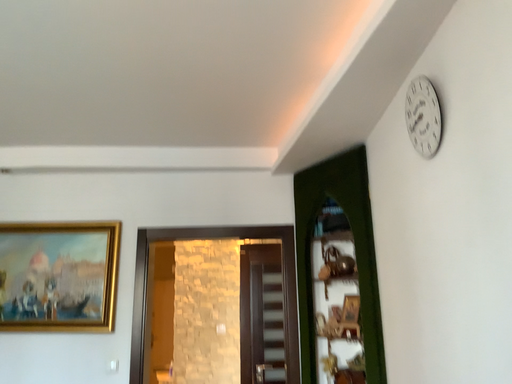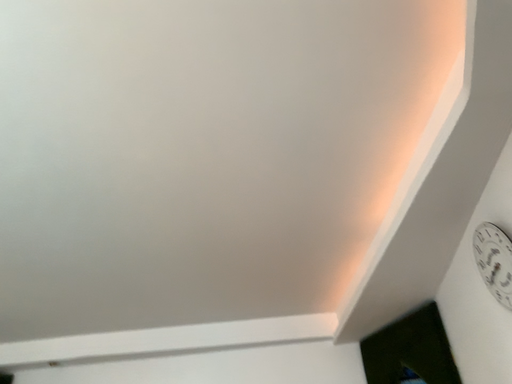
Question: How did the camera likely rotate when shooting the video?

Choices:
 (A) rotated downward
 (B) rotated upward

Answer: (B)